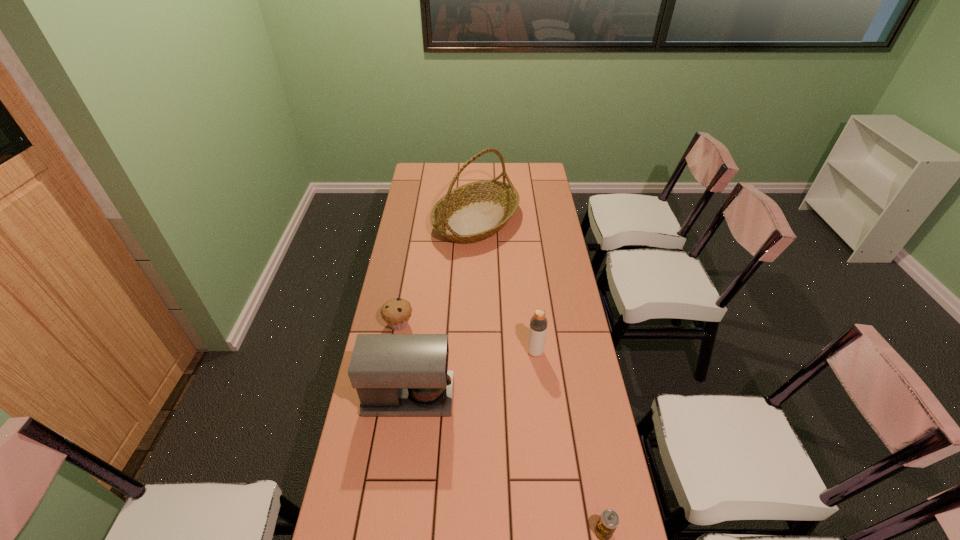
The height and width of the screenshot is (540, 960). Find the location of `coffee maker at the left edge`. coffee maker at the left edge is located at coordinates (394, 374).

This screenshot has width=960, height=540. Identify the location of muffin at the left edge. (396, 312).

Locate an element on the screen. The width and height of the screenshot is (960, 540). object that is at the right edge is located at coordinates (538, 323).

Identify the location of vacant area at the far edge. (486, 169).

You are a GUI agent. You are given a task and a screenshot of the screen. Output one action in this format:
    pyautogui.click(x=<x>, y=<y>)
    Task: Click on the blank space at the left edge of the desktop
    This screenshot has height=540, width=960.
    Given the screenshot: What is the action you would take?
    pyautogui.click(x=376, y=428)

Where is `free space at the right edge`? The height and width of the screenshot is (540, 960). free space at the right edge is located at coordinates (536, 302).

In order to click on vacant region between the muffin and the tallest object in this screenshot , I will do `click(438, 273)`.

In order to click on free space between the fourth nearest object and the basket in this screenshot , I will do `click(438, 273)`.

The height and width of the screenshot is (540, 960). In order to click on free area in between the basket and the fourth nearest object in this screenshot , I will do pos(438,273).

You are a GUI agent. You are given a task and a screenshot of the screen. Output one action in this format:
    pyautogui.click(x=<x>, y=<y>)
    Task: Click on the free point between the basket and the third farthest object
    Image resolution: width=960 pixels, height=540 pixels.
    Given the screenshot: What is the action you would take?
    pyautogui.click(x=506, y=286)